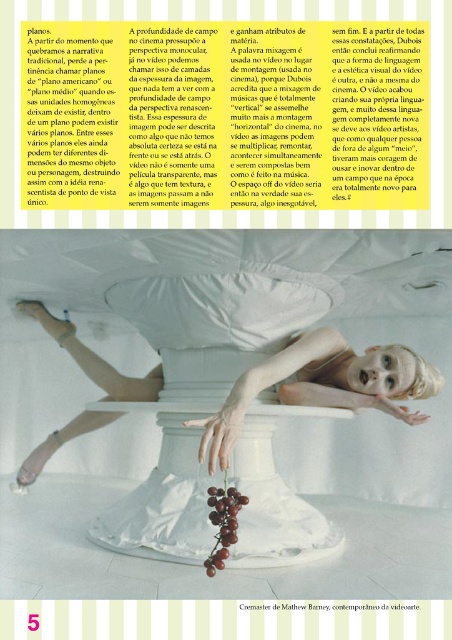
Does white matte dress at center appear on the right side of white cotton pillow at center?

Indeed, white matte dress at center is positioned on the right side of white cotton pillow at center.

Looking at this image, can you confirm if white matte dress at center is smaller than white cotton pillow at center?

Incorrect, white matte dress at center is not smaller in size than white cotton pillow at center.

Who is more distant from viewer, (273, 365) or (123, 291)?

Point (123, 291)

Where is `white matte dress at center`? white matte dress at center is located at coordinates (324, 385).